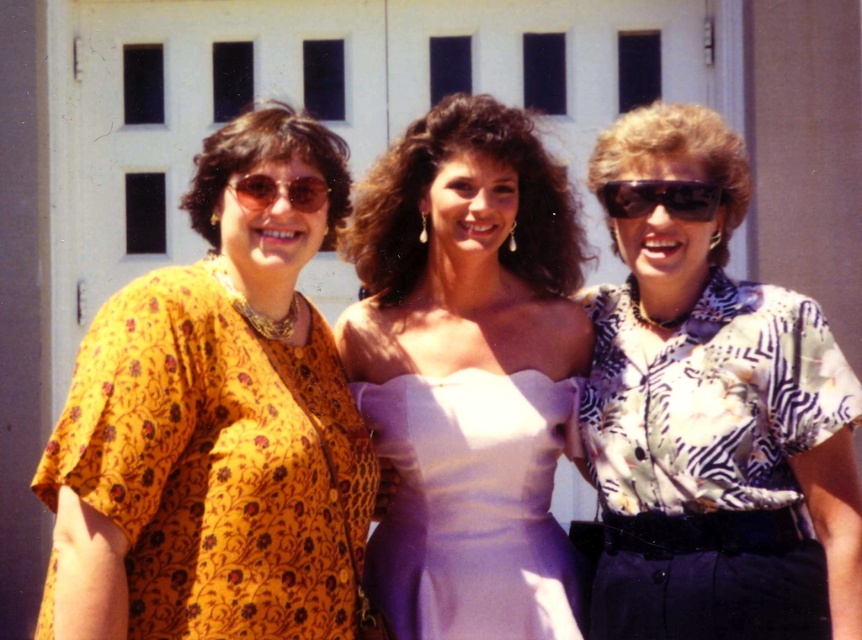
Question: Is yellow floral blouse at left further to the viewer compared to matte white dress at center?

Choices:
 (A) no
 (B) yes

Answer: (A)

Question: Among these objects, which one is farthest from the camera?

Choices:
 (A) black plastic sunglasses at center
 (B) matte white dress at center
 (C) yellow floral blouse at left

Answer: (B)

Question: Considering the real-world distances, which object is closest to the matte white dress at center?

Choices:
 (A) purple satin dress at center
 (B) matte plastic sunglasses at center

Answer: (A)

Question: Does yellow floral blouse at left appear over printed silk blouse at center?

Choices:
 (A) no
 (B) yes

Answer: (B)

Question: In this image, where is yellow floral blouse at left located relative to black plastic sunglasses at center?

Choices:
 (A) above
 (B) below

Answer: (B)

Question: Which object is closer to the camera taking this photo?

Choices:
 (A) printed silk blouse at center
 (B) purple satin dress at center
 (C) matte white dress at center
 (D) matte plastic sunglasses at center

Answer: (A)